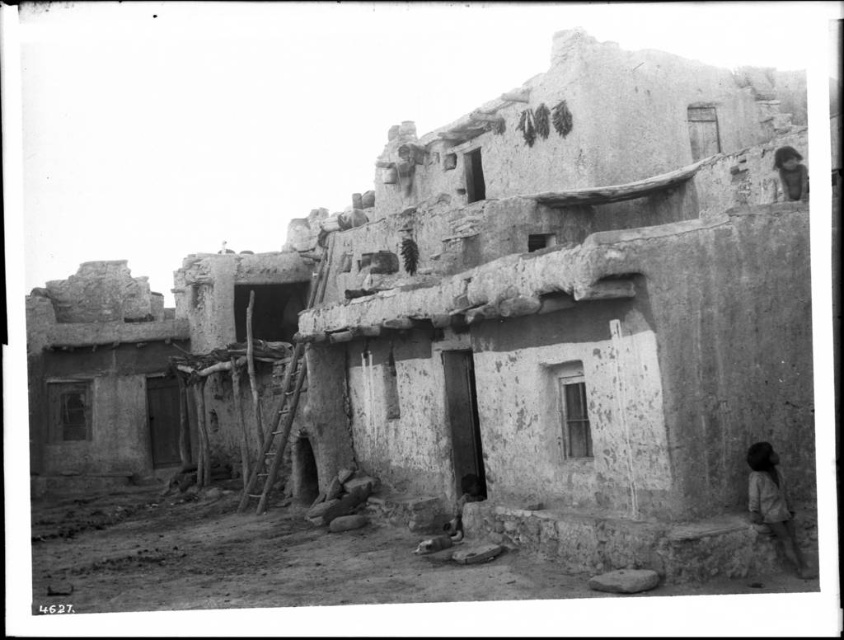
Question: Estimate the real-world distances between objects in this image. Which object is closer to the smooth adobe hut at left?

Choices:
 (A) dark brown leather hat at upper right
 (B) brown textured cloth at lower right

Answer: (A)

Question: Is smooth adobe hut at left thinner than dark brown leather hat at upper right?

Choices:
 (A) no
 (B) yes

Answer: (A)

Question: Does wooden rustic ladder at center appear over dark brown leather hat at upper right?

Choices:
 (A) no
 (B) yes

Answer: (A)

Question: Which object appears closest to the camera in this image?

Choices:
 (A) smooth adobe hut at left
 (B) wooden ladder at center-left
 (C) dark brown leather hat at upper right
 (D) brown textured cloth at lower right

Answer: (D)

Question: Can you confirm if brown textured cloth at lower right is positioned to the right of dark brown leather hat at upper right?

Choices:
 (A) yes
 (B) no

Answer: (B)

Question: Which of these objects is positioned farthest from the wooden rustic ladder at center?

Choices:
 (A) brown textured cloth at lower right
 (B) dark brown leather hat at upper right
 (C) wooden ladder at center-left
 (D) smooth adobe hut at left

Answer: (A)